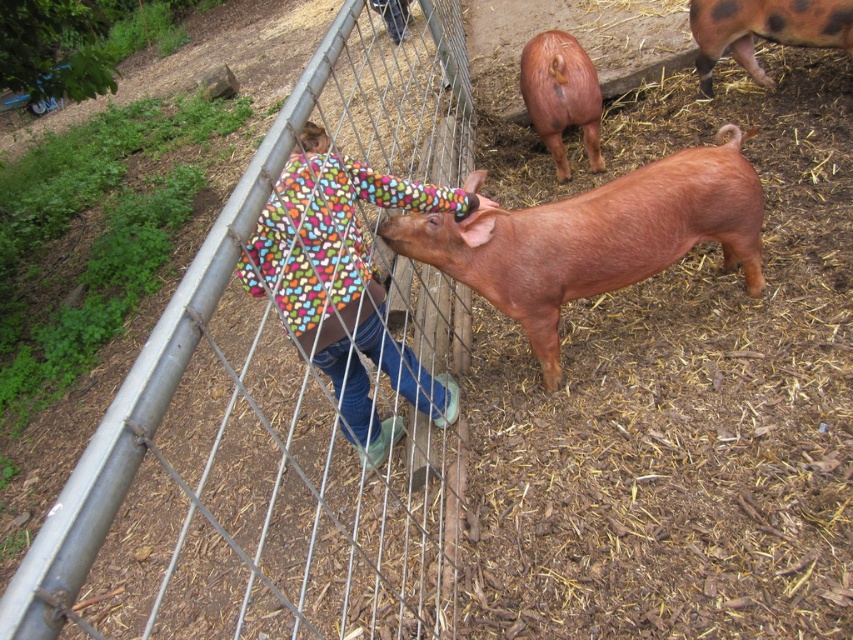
Question: Among these points, which one is nearest to the camera?

Choices:
 (A) (831, 19)
 (B) (306, 248)

Answer: (B)

Question: Which object is the closest to the metal wire fence at center?

Choices:
 (A) smooth reddish-brown pig at center
 (B) multicolored fleece jacket at center

Answer: (B)

Question: Can you confirm if smooth reddish-brown pig at center is positioned above matte brown pig at upper right?

Choices:
 (A) yes
 (B) no

Answer: (B)

Question: In this image, where is metal wire fence at center located relative to smooth reddish-brown pig at center?

Choices:
 (A) below
 (B) above

Answer: (A)

Question: Is metal wire fence at center thinner than smooth reddish-brown pig at center?

Choices:
 (A) no
 (B) yes

Answer: (A)

Question: Considering the real-world distances, which object is closest to the multicolored fleece jacket at center?

Choices:
 (A) metal wire fence at center
 (B) brown matte pig at center
 (C) matte brown pig at upper right

Answer: (A)